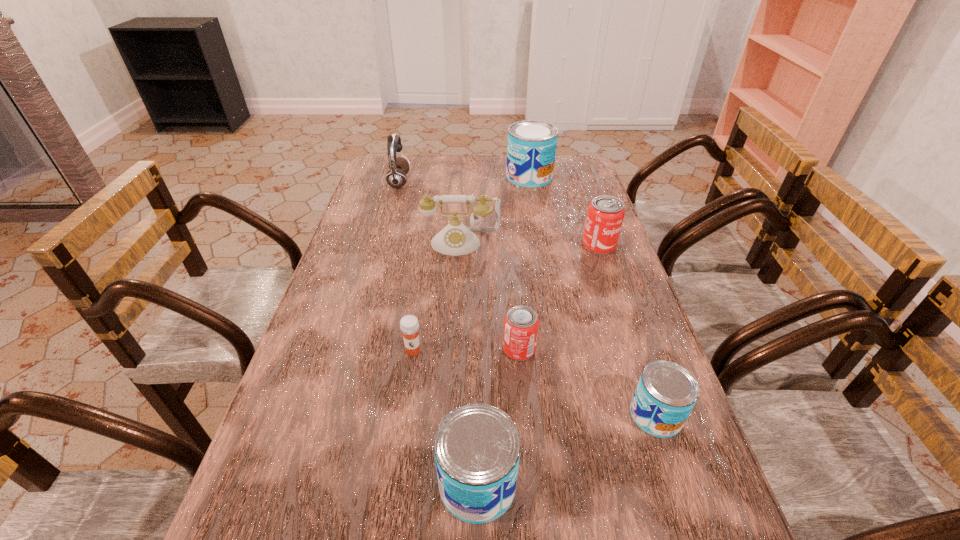
The image size is (960, 540). I want to click on blank space located 0.080m on the back of the smallest blue can, so click(638, 362).

The width and height of the screenshot is (960, 540). Find the location of `free location located 0.100m on the label side of the medicine`. free location located 0.100m on the label side of the medicine is located at coordinates (407, 396).

Identify the location of earphone that is at the far edge. coord(396,177).

Locate an element on the screen. Image resolution: width=960 pixels, height=540 pixels. can that is at the far edge is located at coordinates (531, 149).

Locate an element on the screen. The width and height of the screenshot is (960, 540). object present at the left edge is located at coordinates (396, 177).

Locate an element on the screen. This screenshot has height=540, width=960. object that is at the far left corner is located at coordinates (396, 177).

You are a GUI agent. You are given a task and a screenshot of the screen. Output one action in this format:
    pyautogui.click(x=<x>, y=<y>)
    Task: Click on the object present at the far right corner
    Image resolution: width=960 pixels, height=540 pixels.
    Given the screenshot: What is the action you would take?
    pyautogui.click(x=531, y=149)

The width and height of the screenshot is (960, 540). Identify the location of free space at the far edge of the desktop. (498, 168).

This screenshot has height=540, width=960. I want to click on free space at the left edge of the desktop, so click(369, 223).

The image size is (960, 540). In the image, there is a desktop. Find the location of `free region at the right edge`. free region at the right edge is located at coordinates (564, 231).